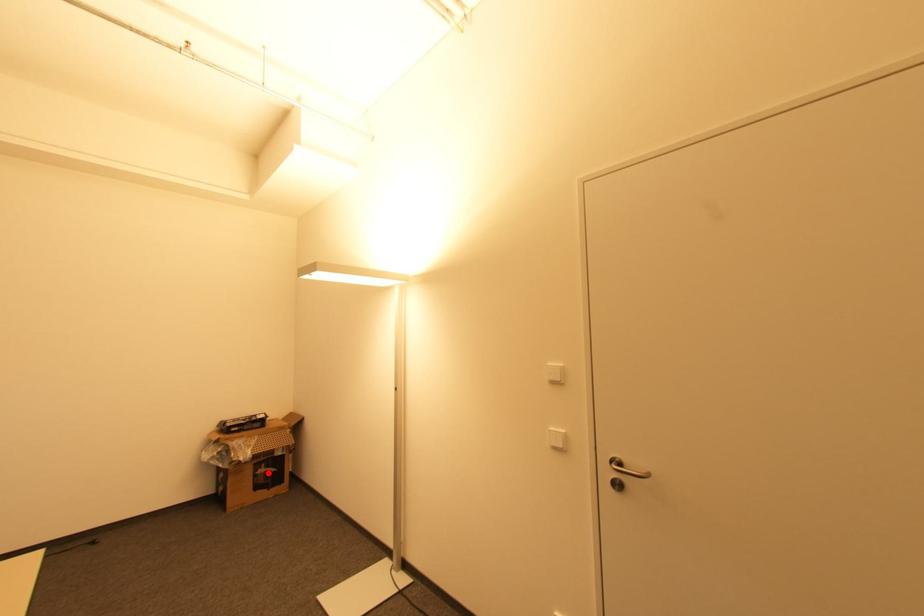
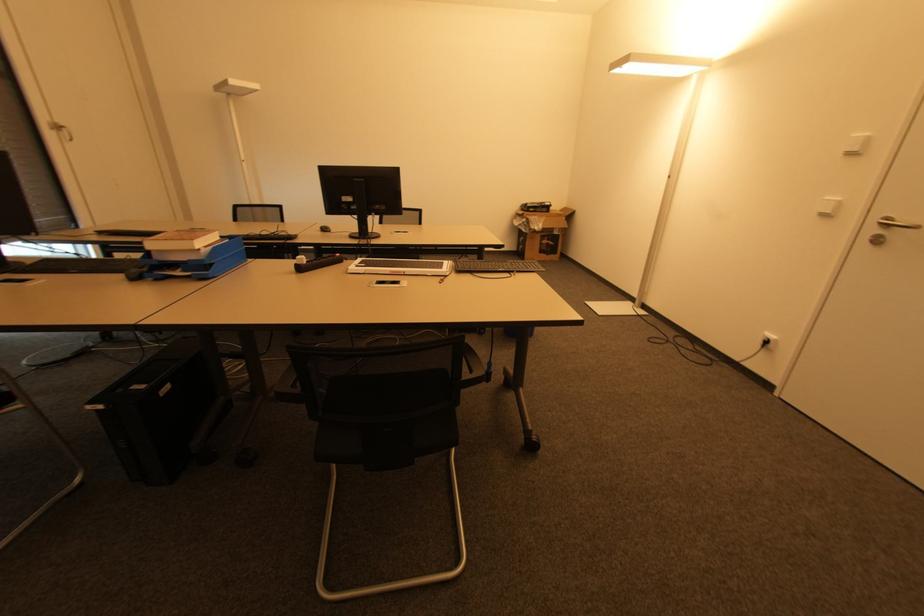
Find the pixel in the second image that matches the highlighted location in the first image.

(550, 245)